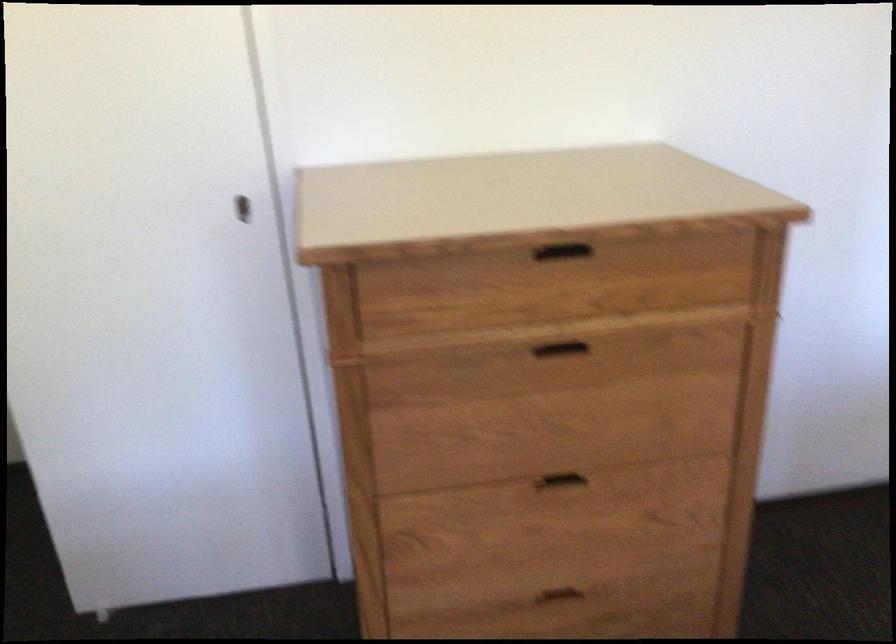
The images are taken continuously from a first-person perspective. In which direction is your viewpoint rotating?

The camera rotated toward right-down.